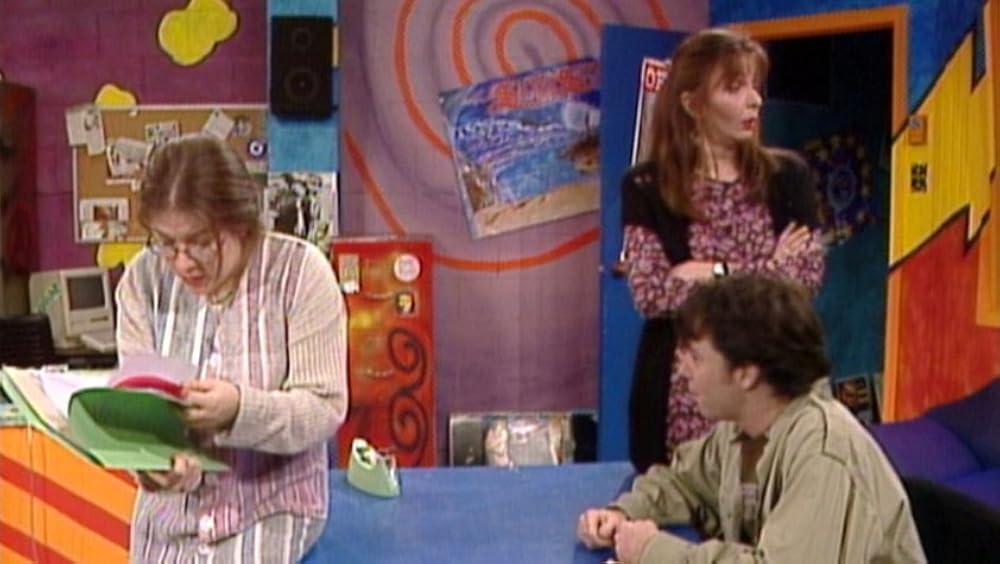
This screenshot has height=564, width=1000. Find the location of `door frame`. door frame is located at coordinates (842, 22), (888, 363).